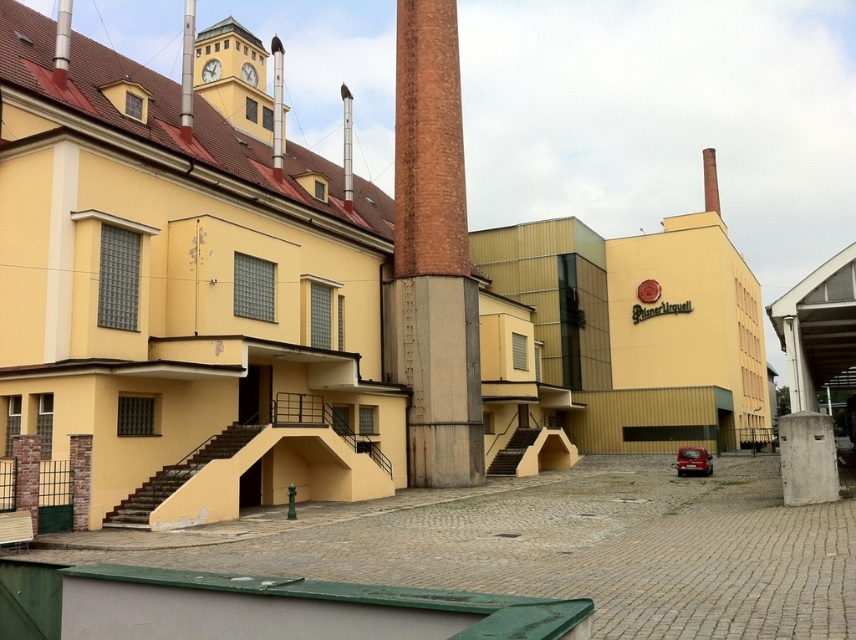
Question: Does concrete at center appear under brown brick chimney at upper center?

Choices:
 (A) yes
 (B) no

Answer: (A)

Question: Which point appears closest to the camera in this image?

Choices:
 (A) (705, 173)
 (B) (217, 74)
 (C) (792, 422)
 (D) (251, 80)

Answer: (C)

Question: Which of the following is the farthest from the observer?

Choices:
 (A) tap(210, 60)
 (B) tap(791, 420)
 (C) tap(703, 154)

Answer: (C)

Question: Is concrete at center thinner than metallic clock at upper center?

Choices:
 (A) no
 (B) yes

Answer: (A)

Question: Among these objects, which one is farthest from the camera?

Choices:
 (A) brown brick chimney at upper center
 (B) metallic clock face at upper center
 (C) matte yellow clock tower at upper center
 (D) brick chimney at center

Answer: (A)

Question: Does matte yellow clock tower at upper center have a lesser width compared to metallic clock at upper center?

Choices:
 (A) yes
 (B) no

Answer: (B)